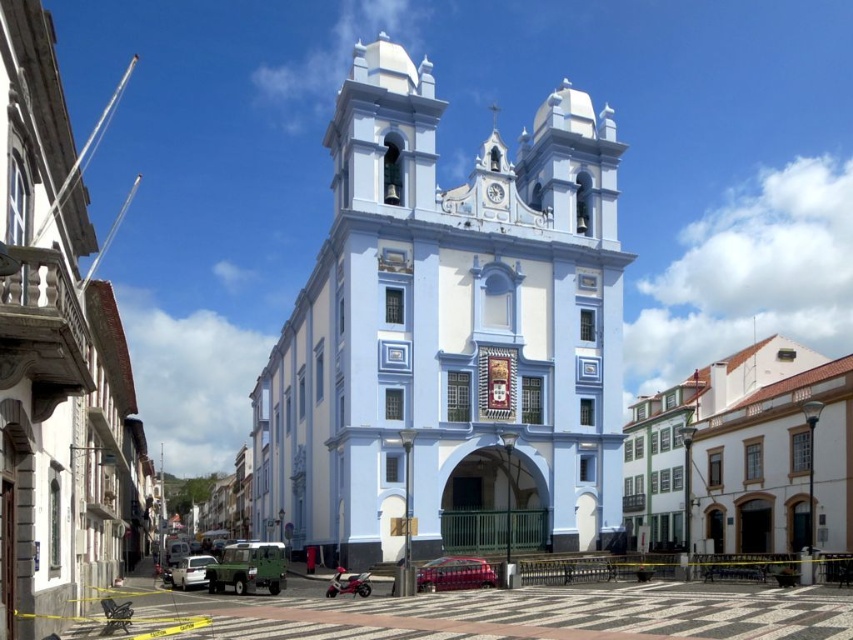
You are a tour guide leading a group to the historic church. You need to park your tour bus, which is 12 meters long, between the metallic red car at center and the white matte car at lower left. Is there enough space between them to park the bus without moving either car?

The metallic red car at center and the white matte car at lower left are 27.70 meters apart from each other. Since the tour bus is 12 meters long, there is sufficient space between them to park the bus without moving either car.

You are a photographer planning to take a picture of the church with both the metallic red car at center and the white matte car at lower left in the frame. Which car should you position closer to the camera to ensure both are fully visible without cropping?

You should position the metallic red car at center closer to the camera because it is shorter than the white matte car at lower left. This way, the taller white matte car at lower left can be placed further back while still fitting within the frame.

You are standing in the town square and want to walk from the point at coordinates point (480, 557) to the point at coordinates point (183, 582). Which direction should you move relative to the church?

Since point (480, 557) is in front of point (183, 582), you should move towards the direction away from the church to reach point (183, 582) from point (480, 557).